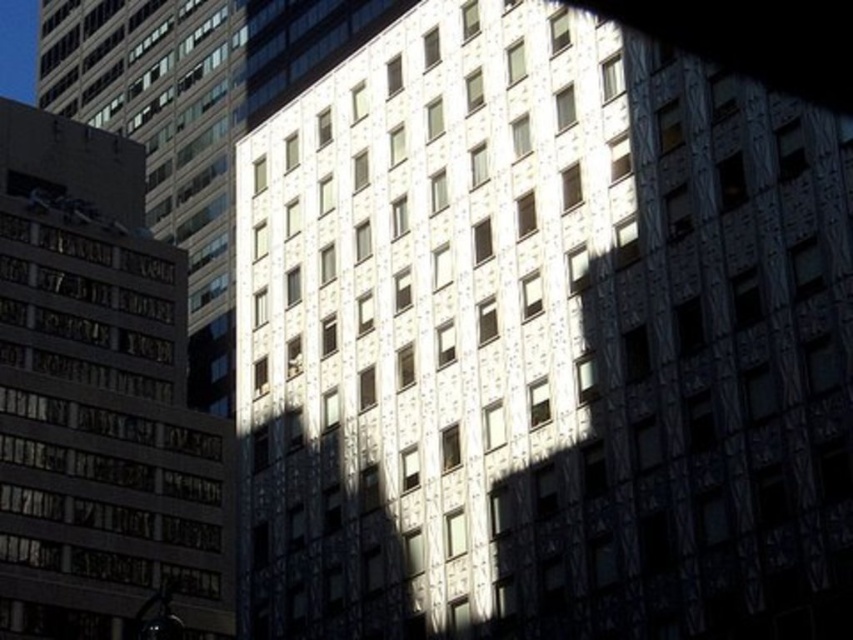
Is point (393, 115) in front of point (59, 152)?

Yes, point (393, 115) is in front of point (59, 152).

Where is `white textured building at center`? The width and height of the screenshot is (853, 640). white textured building at center is located at coordinates pyautogui.click(x=543, y=342).

Between point (640, 301) and point (125, 208), which one is positioned behind?

The point (125, 208) is more distant.

You are a GUI agent. You are given a task and a screenshot of the screen. Output one action in this format:
    pyautogui.click(x=<x>, y=<y>)
    Task: Click on the white textured building at center
    Image resolution: width=853 pixels, height=640 pixels.
    Given the screenshot: What is the action you would take?
    pyautogui.click(x=543, y=342)